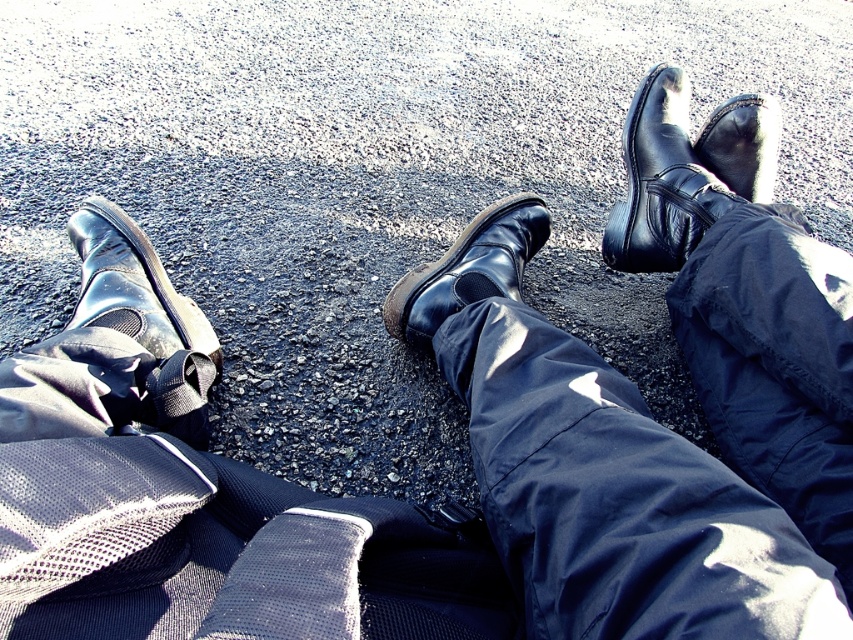
Question: Is navy blue fabric pants at center thinner than glossy leather boot at lower left?

Choices:
 (A) yes
 (B) no

Answer: (B)

Question: Does glossy leather boot at lower left appear on the left side of shiny black boot at center?

Choices:
 (A) no
 (B) yes

Answer: (B)

Question: Which object is farther from the camera taking this photo?

Choices:
 (A) shiny black boot at upper center
 (B) shiny black boot at center
 (C) navy blue fabric pants at center
 (D) shiny black boot at upper right

Answer: (A)

Question: Is shiny black boot at upper right further to camera compared to shiny black boot at center?

Choices:
 (A) yes
 (B) no

Answer: (A)

Question: Which point is closer to the camera?

Choices:
 (A) shiny black boot at upper center
 (B) glossy leather boot at lower left
 (C) shiny black boot at center

Answer: (B)

Question: Which object is positioned farthest from the shiny black boot at upper right?

Choices:
 (A) glossy leather boot at lower left
 (B) shiny black boot at center
 (C) navy blue fabric pants at center
 (D) shiny black boot at upper center

Answer: (A)